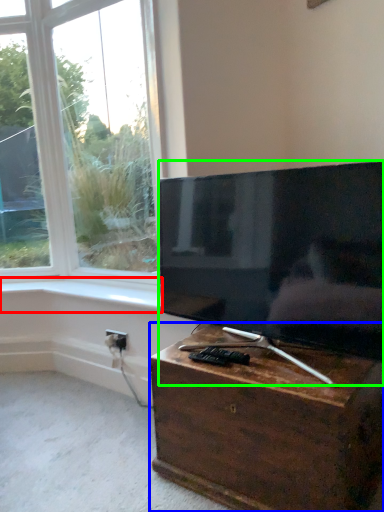
Question: Considering the real-world distances, which object is farthest from window sill (highlighted by a red box)? nightstand (highlighted by a blue box) or television (highlighted by a green box)?

Choices:
 (A) nightstand
 (B) television

Answer: (A)